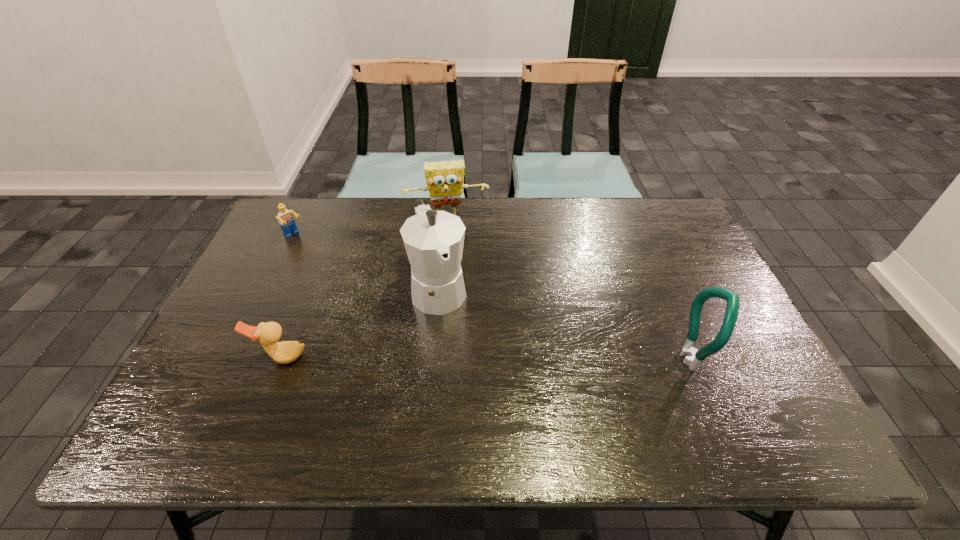
The image size is (960, 540). Identify the location of vacant area at the near right corner. (736, 395).

You are a GUI agent. You are given a task and a screenshot of the screen. Output one action in this format:
    pyautogui.click(x=<x>, y=<y>)
    Task: Click on the free space between the bottle opener and the Lego
    The image size is (960, 540).
    Given the screenshot: What is the action you would take?
    pyautogui.click(x=493, y=298)

I want to click on free space between the rightmost object and the coffeepot, so click(x=566, y=324).

Where is `free space between the fourth nearest object and the bottle opener`? This screenshot has width=960, height=540. free space between the fourth nearest object and the bottle opener is located at coordinates (493, 298).

Identify the location of vacant area between the leftmost object and the bottle opener. The width and height of the screenshot is (960, 540). (493, 298).

At what (x,y) coordinates should I click in order to perform the action: click on free spot between the Lego and the third nearest object. Please return your answer as a coordinate pair (x, y). Image resolution: width=960 pixels, height=540 pixels. Looking at the image, I should click on (367, 262).

Where is `vacant space that is in between the Lego and the second object from left to right`? The height and width of the screenshot is (540, 960). vacant space that is in between the Lego and the second object from left to right is located at coordinates tap(288, 297).

Identify the location of free point between the second farthest object and the tallest object. (367, 262).

Where is `free space between the coffeepot and the fourth nearest object`? free space between the coffeepot and the fourth nearest object is located at coordinates (367, 262).

The width and height of the screenshot is (960, 540). What are the coordinates of `vacant space that's between the third nearest object and the rightmost object` in the screenshot? It's located at (566, 324).